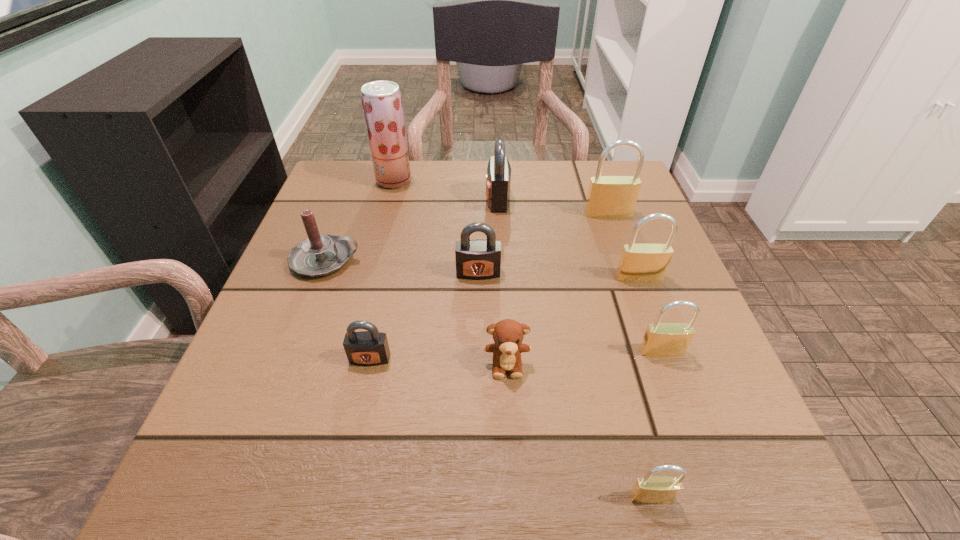
You are a GUI agent. You are given a task and a screenshot of the screen. Output one action in this format:
    pyautogui.click(x=<x>, y=<y>)
    Task: Click on the vacant area that lies between the brown teddy bear and the second farthest gray padlock
    This screenshot has width=960, height=540.
    Given the screenshot: What is the action you would take?
    pyautogui.click(x=492, y=319)

Find the location of a particular element. The height and width of the screenshot is (540, 960). vacant area that lies between the farthest brass padlock and the nearest gray padlock is located at coordinates (489, 286).

This screenshot has width=960, height=540. I want to click on empty space between the second farthest gray padlock and the candle, so click(402, 266).

Image resolution: width=960 pixels, height=540 pixels. In order to click on vacant area between the second farthest gray padlock and the candle in this screenshot , I will do `click(402, 266)`.

What are the coordinates of `free space between the tallest object and the teddy bear` in the screenshot? It's located at (450, 273).

Locate an element on the screen. blank region between the farthest brass padlock and the nearest object is located at coordinates (630, 355).

Find the location of `the ninth closest object to the third smallest brass padlock`. the ninth closest object to the third smallest brass padlock is located at coordinates (382, 103).

Locate an element on the screen. object that ranks as the eighth closest to the biggest gray padlock is located at coordinates (661, 339).

Identify which padlock is located as the sixth nearest to the third nearest brass padlock. Please provide its 2D coordinates. Your answer should be formatted as a tuple, i.e. [(x, y)], where the tuple contains the x and y coordinates of a point satisfying the conditions above.

[(364, 348)]

Point out which padlock is positioned as the second nearest to the second nearest brass padlock. Please provide its 2D coordinates. Your answer should be formatted as a tuple, i.e. [(x, y)], where the tuple contains the x and y coordinates of a point satisfying the conditions above.

[(649, 489)]